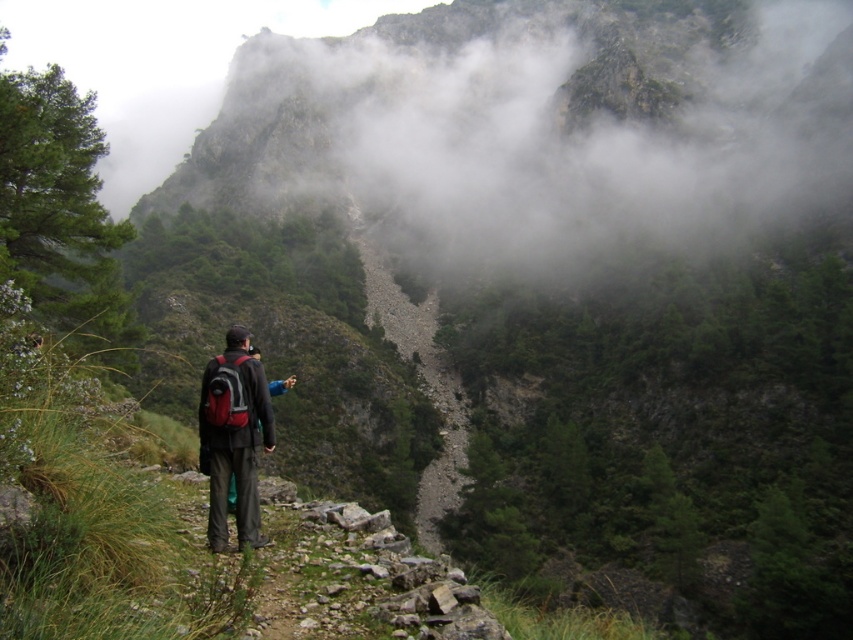
Between gray rocky trail at center and matte black backpack at center, which one appears on the left side from the viewer's perspective?

From the viewer's perspective, matte black backpack at center appears more on the left side.

Can you confirm if gray rocky trail at center is thinner than matte black backpack at center?

Incorrect, gray rocky trail at center's width is not less than matte black backpack at center's.

Where is `gray rocky trail at center`? gray rocky trail at center is located at coordinates coord(419,374).